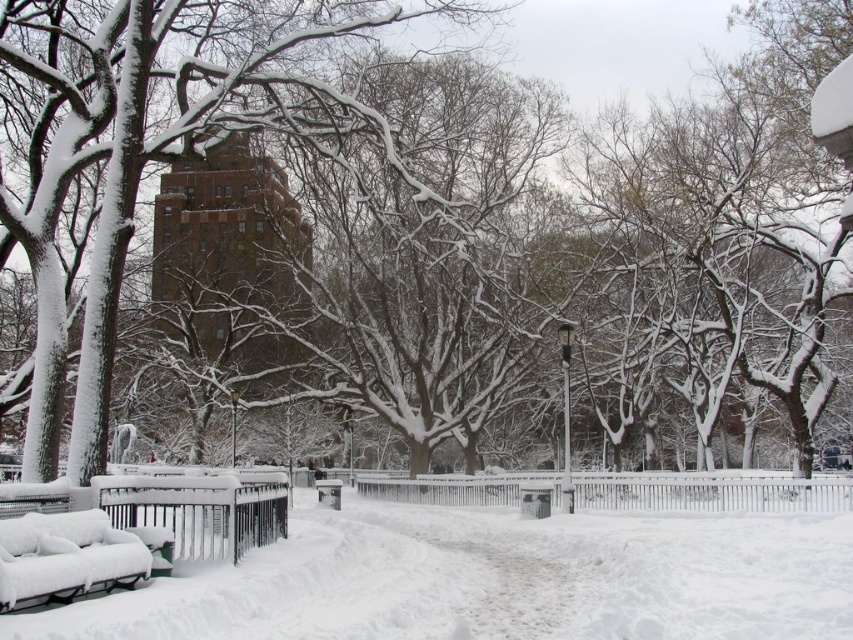
Question: Among these objects, which one is farthest from the camera?

Choices:
 (A) white snow-covered bench at lower left
 (B) white fluffy snow at center

Answer: (A)

Question: Which object appears closest to the camera in this image?

Choices:
 (A) white fluffy snow at center
 (B) white snow-covered bench at lower left

Answer: (A)

Question: Which point is farther to the camera?

Choices:
 (A) white fluffy snow at center
 (B) white snow-covered bench at lower left

Answer: (B)

Question: Is white fluffy snow at center smaller than white snow-covered bench at lower left?

Choices:
 (A) no
 (B) yes

Answer: (A)

Question: Does white fluffy snow at center appear over white snow-covered bench at lower left?

Choices:
 (A) no
 (B) yes

Answer: (A)

Question: Is white fluffy snow at center in front of white snow-covered bench at lower left?

Choices:
 (A) no
 (B) yes

Answer: (B)